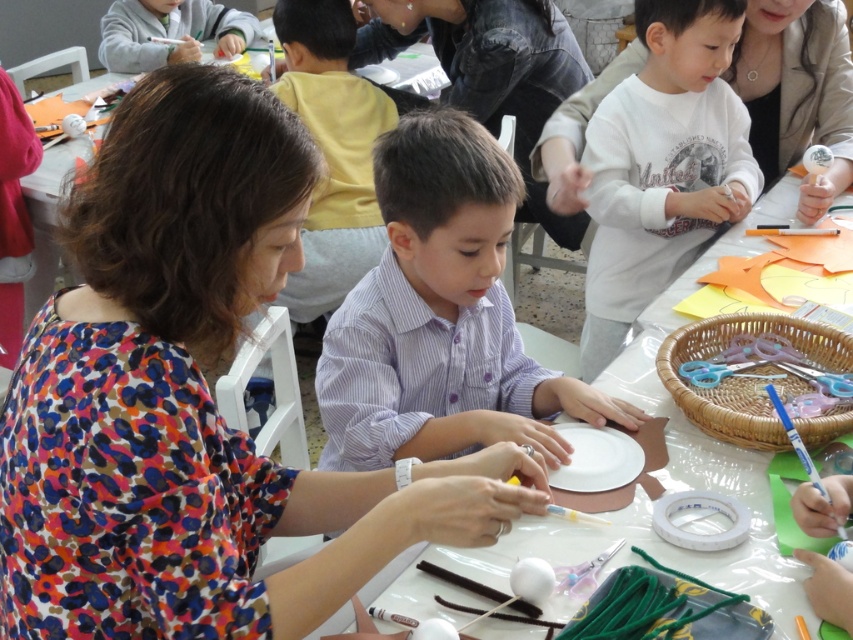
Question: Can you confirm if white paper plate at center is positioned to the right of white matte paper plate at center?

Choices:
 (A) no
 (B) yes

Answer: (B)

Question: Can you confirm if white striped shirt at center is wider than white paper plate at center?

Choices:
 (A) yes
 (B) no

Answer: (B)

Question: Among these points, which one is nearest to the camera?

Choices:
 (A) (608, 476)
 (B) (210, 20)
 (C) (799, 8)
 (D) (641, 385)

Answer: (A)

Question: Among these objects, which one is farthest from the camera?

Choices:
 (A) matte black shirt at upper center
 (B) white cotton shirt at upper center
 (C) white matte paper plate at center
 (D) matte gray sweater at upper left

Answer: (D)

Question: Based on their relative distances, which object is farther from the white cotton shirt at upper center?

Choices:
 (A) white striped shirt at center
 (B) matte gray sweater at upper left

Answer: (B)

Question: Can you confirm if white cotton shirt at upper center is positioned to the left of matte gray sweater at upper left?

Choices:
 (A) no
 (B) yes

Answer: (A)